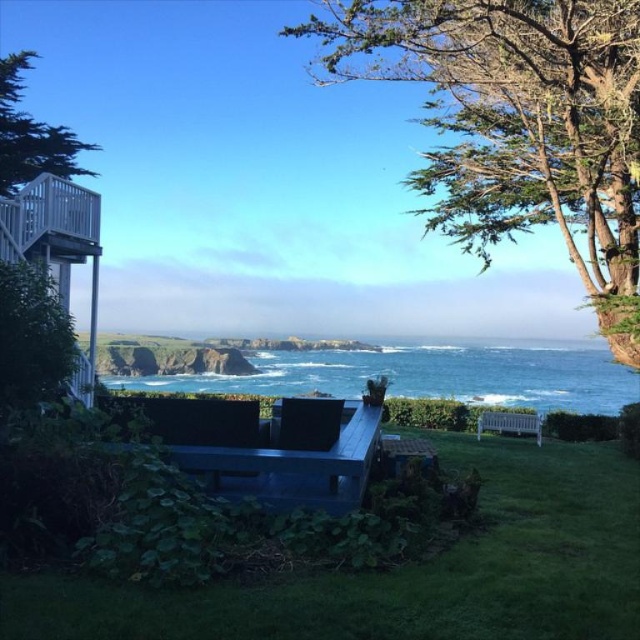
Question: Does green textured tree at upper right appear over blue plastic bench at center?

Choices:
 (A) no
 (B) yes

Answer: (B)

Question: In this image, where is blue wood bench at center located relative to blue plastic bench at center?

Choices:
 (A) below
 (B) above

Answer: (B)

Question: Estimate the real-world distances between objects in this image. Which object is farther from the blue ocean water at center?

Choices:
 (A) green textured tree at upper left
 (B) green textured tree at upper right

Answer: (A)

Question: Among these objects, which one is farthest from the camera?

Choices:
 (A) blue wood bench at center
 (B) green grass at lower center
 (C) blue plastic bench at center
 (D) green textured tree at upper left

Answer: (D)

Question: Is green textured tree at upper left bigger than blue plastic bench at center?

Choices:
 (A) yes
 (B) no

Answer: (A)

Question: Which point is closer to the camera taking this photo?

Choices:
 (A) (480, 461)
 (B) (516, 413)
 (C) (497, 60)
 (D) (275, 500)

Answer: (D)